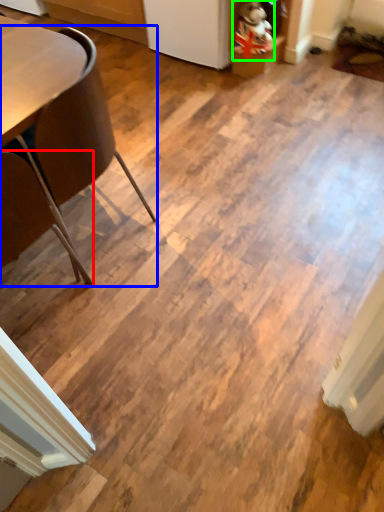
Question: Considering the real-world distances, which object is farthest from chair (highlighted by a red box)? chair (highlighted by a blue box) or toy (highlighted by a green box)?

Choices:
 (A) chair
 (B) toy

Answer: (B)